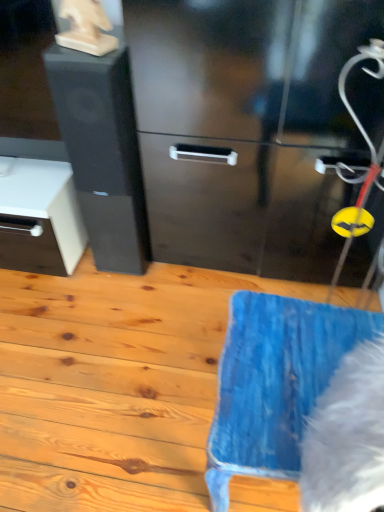
Question: Can we say white fluffy animal at lower right lies outside black matte/file cabinet at left?

Choices:
 (A) no
 (B) yes

Answer: (B)

Question: Is black matte/file cabinet at left at the back of white fluffy animal at lower right?

Choices:
 (A) yes
 (B) no

Answer: (B)

Question: From the image's perspective, does white fluffy animal at lower right appear higher than black matte/file cabinet at left?

Choices:
 (A) no
 (B) yes

Answer: (A)

Question: From the image's perspective, would you say white fluffy animal at lower right is shown under black matte/file cabinet at left?

Choices:
 (A) yes
 (B) no

Answer: (A)

Question: Does white fluffy animal at lower right have a greater width compared to black matte/file cabinet at left?

Choices:
 (A) no
 (B) yes

Answer: (A)

Question: Considering the positions of point (82, 196) and point (336, 415), is point (82, 196) closer or farther from the camera than point (336, 415)?

Choices:
 (A) closer
 (B) farther

Answer: (B)

Question: Considering the relative positions of black matte/file cabinet at left and white fluffy animal at lower right in the image provided, is black matte/file cabinet at left to the left or to the right of white fluffy animal at lower right?

Choices:
 (A) left
 (B) right

Answer: (A)

Question: Looking at the image, does black matte/file cabinet at left seem bigger or smaller compared to white fluffy animal at lower right?

Choices:
 (A) big
 (B) small

Answer: (A)

Question: In terms of height, does black matte/file cabinet at left look taller or shorter compared to white fluffy animal at lower right?

Choices:
 (A) short
 (B) tall

Answer: (B)

Question: Relative to black matte/file cabinet at left, is white fluffy animal at lower right in front or behind?

Choices:
 (A) front
 (B) behind

Answer: (A)

Question: In terms of size, does white fluffy animal at lower right appear bigger or smaller than black matte/file cabinet at left?

Choices:
 (A) big
 (B) small

Answer: (B)

Question: Does point (362, 413) appear closer or farther from the camera than point (82, 90)?

Choices:
 (A) closer
 (B) farther

Answer: (A)

Question: Is white fluffy animal at lower right taller or shorter than black matte/file cabinet at left?

Choices:
 (A) tall
 (B) short

Answer: (B)

Question: Is white fluffy animal at lower right bigger or smaller than blue fabric at lower right?

Choices:
 (A) big
 (B) small

Answer: (B)

Question: Considering the positions of white fluffy animal at lower right and blue fabric at lower right in the image, is white fluffy animal at lower right taller or shorter than blue fabric at lower right?

Choices:
 (A) short
 (B) tall

Answer: (B)